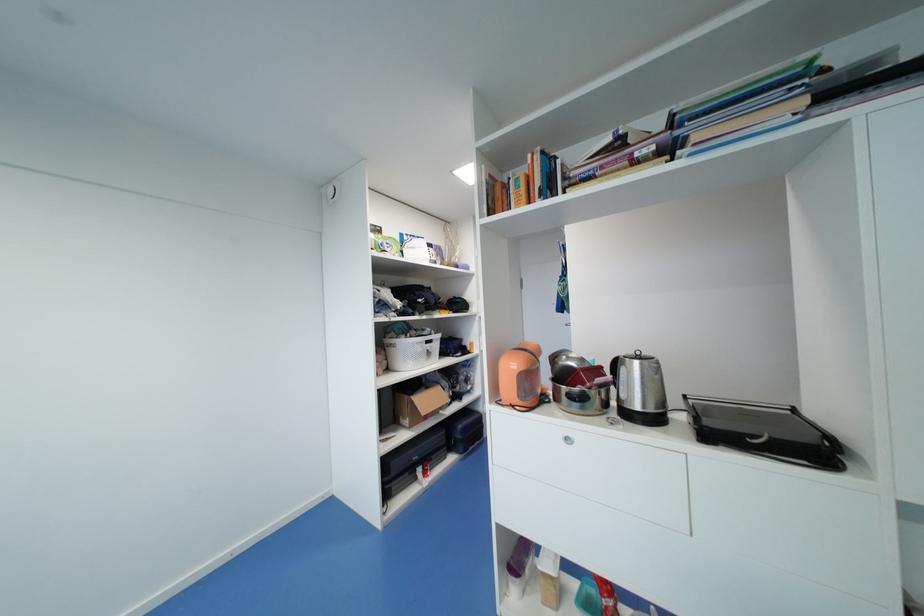
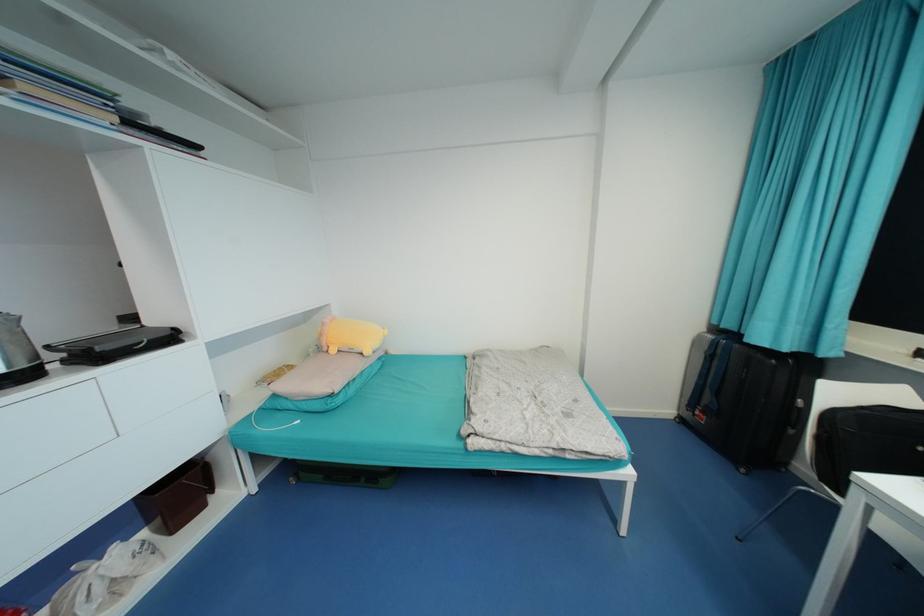
Locate, in the second image, the point that corresponds to [699,138] in the first image.

(28, 87)